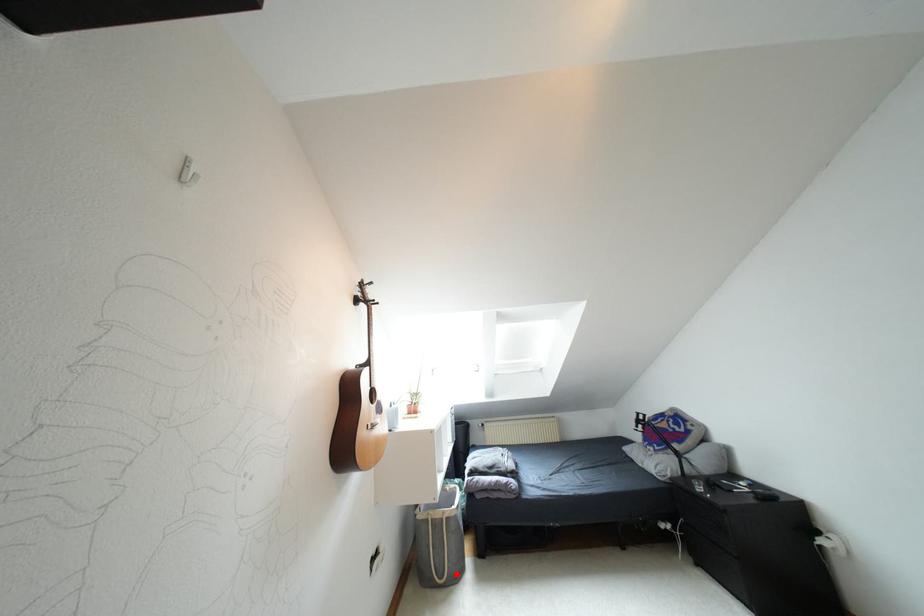
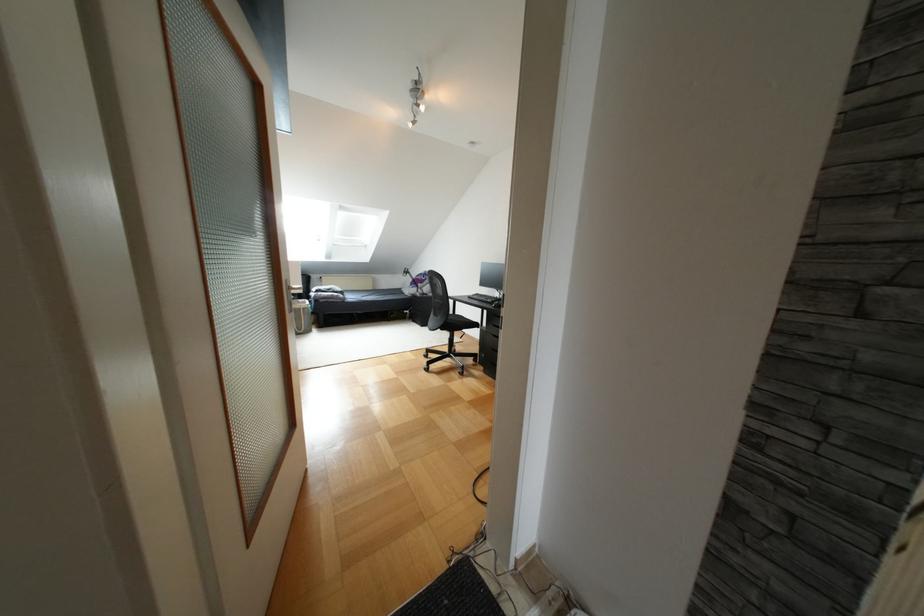
Question: I am providing you with two images of the same scene from different viewpoints. Image1 has a red point marked. In image2, the corresponding 3D location appears at what relative position? Reply with the corresponding letter.

Choices:
 (A) Closer
 (B) Farther

Answer: (B)